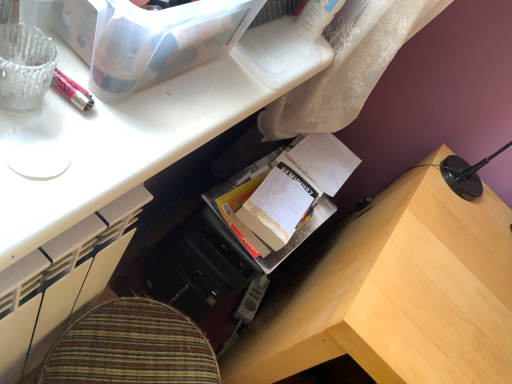
Identify the location of unoccupied space behind translucent glass pen at upper left. The width and height of the screenshot is (512, 384). (149, 85).